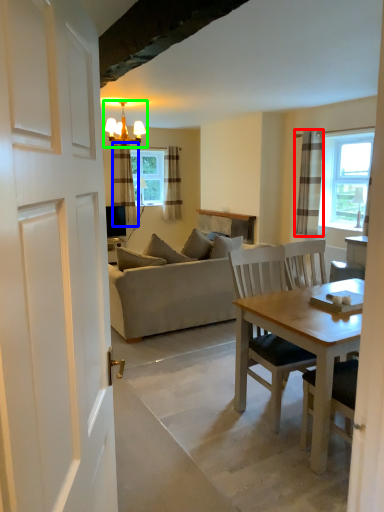
Question: Considering the real-world distances, which object is farthest from curtain (highlighted by a red box)? curtain (highlighted by a blue box) or light fixture (highlighted by a green box)?

Choices:
 (A) curtain
 (B) light fixture

Answer: (A)